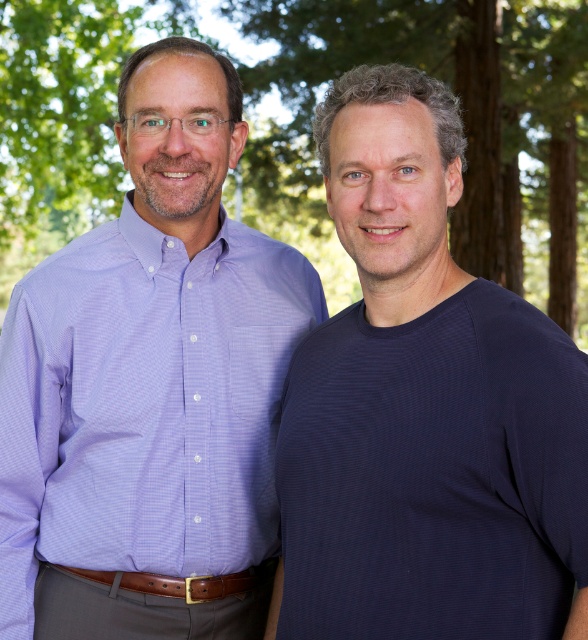
You are standing in a park and want to take a photo of the point at coordinates (576, 166). The camera you are using has a maximum focus range of 50 feet. Will the camera be able to focus on the point?

The distance of point (576, 166) from the camera is 51.34 feet, which exceeds the camera maximum focus range of 50 feet. Therefore, the camera will not be able to focus on the point.

You are standing in a park and see two points marked in the image. The first point is at coordinates point (462, 340) and the second is at point (360, 10). Which point is nearer to you?

Point (462, 340) is closer to the viewer than point (360, 10).